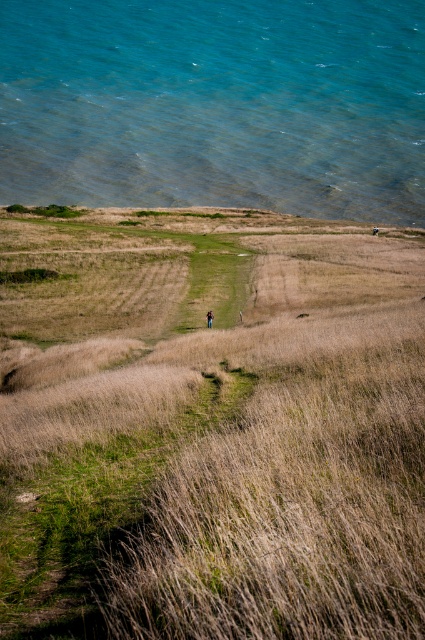
You are standing at the point marked as point (210, 426) in the image. What type of vegetation do you see directly beneath your feet?

The point (210, 426) is where dry grass at center is located, so you would see dry grass at center beneath your feet.

You are a hiker who just arrived at the coastal landscape. You see the dry grass at center and the brown leather backpack at center. Which object is positioned more to the right side of the scene?

The dry grass at center is positioned more to the right side of the scene compared to the brown leather backpack at center.

You are a hiker trying to reach the clear blue water at upper left. There is dry grass at center in your path. Can you walk around it to get to the water?

The dry grass at center is smaller than the clear blue water at upper left, so yes, you can walk around the dry grass at center to reach the clear blue water at upper left.